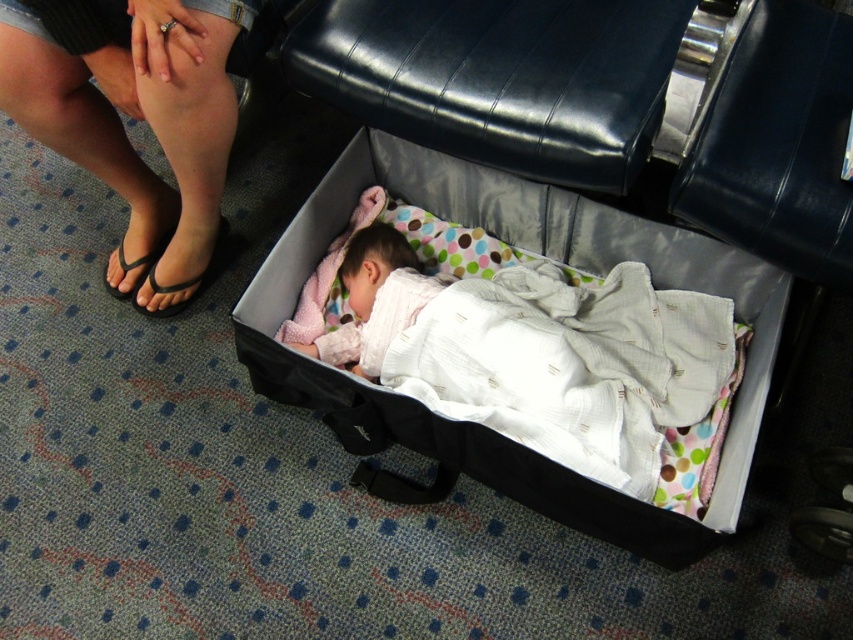
Between white soft fabric baby at center and black flip-flops at lower left, which one is positioned higher?

black flip-flops at lower left is above.

Can you confirm if white soft fabric baby at center is positioned to the right of black flip-flops at lower left?

Indeed, white soft fabric baby at center is positioned on the right side of black flip-flops at lower left.

What do you see at coordinates (538, 353) in the screenshot?
I see `white soft fabric baby at center` at bounding box center [538, 353].

I want to click on white soft fabric baby at center, so click(538, 353).

How much distance is there between black flip-flops at lower left and black flip-flop at lower left?

The distance of black flip-flops at lower left from black flip-flop at lower left is 6.74 inches.

Is black flip-flops at lower left smaller than black flip-flop at lower left?

Actually, black flip-flops at lower left might be larger than black flip-flop at lower left.

Is point (213, 186) more distant than point (160, 252)?

No, it is not.

Where is `black flip-flops at lower left`? black flip-flops at lower left is located at coordinates (132, 116).

Which is more to the right, black flip-flops at lower left or black rubber sandal at lower left?

black rubber sandal at lower left

Between point (198, 122) and point (218, 266), which one is positioned in front?

Point (198, 122)

Who is more distant from viewer, (210,109) or (137,307)?

Point (137,307)

Locate an element on the screen. Image resolution: width=853 pixels, height=640 pixels. black flip-flops at lower left is located at coordinates (132, 116).